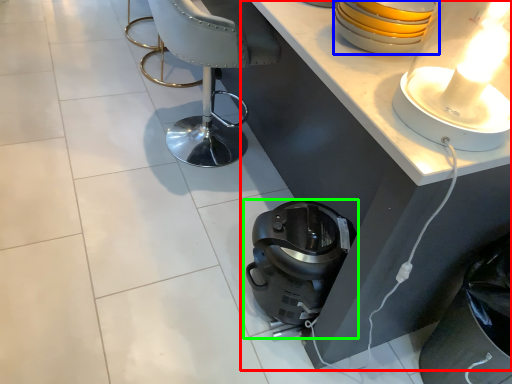
Question: Considering the real-world distances, which object is closest to table (highlighted by a red box)? appliance (highlighted by a blue box) or home appliance (highlighted by a green box).

Choices:
 (A) appliance
 (B) home appliance

Answer: (A)